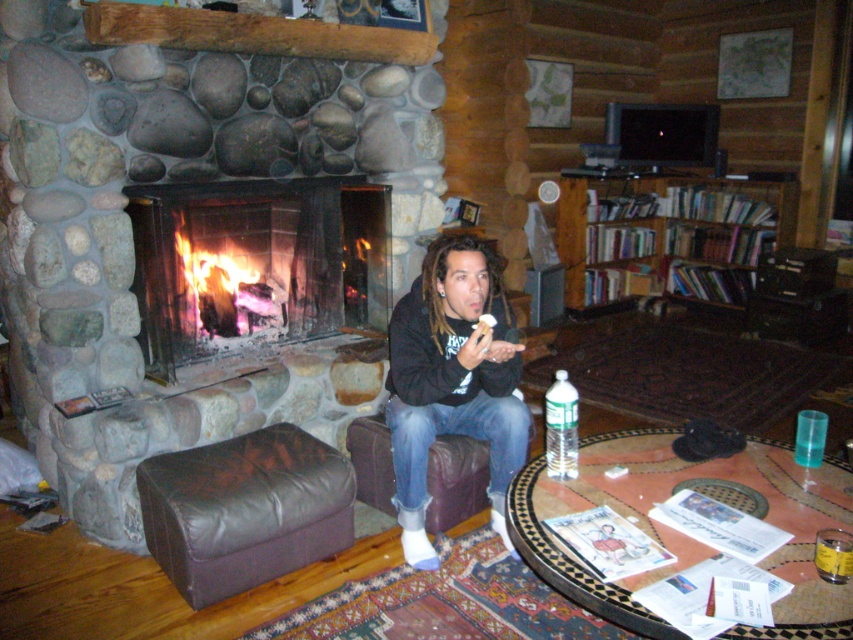
Is point (234, 472) behind point (567, 468)?

Yes, it is behind point (567, 468).

This screenshot has height=640, width=853. What do you see at coordinates (244, 509) in the screenshot?
I see `brown leather ottoman at lower center` at bounding box center [244, 509].

Where is `brown leather ottoman at lower center`? The image size is (853, 640). brown leather ottoman at lower center is located at coordinates (244, 509).

Between point (193, 241) and point (740, 256), which one is positioned in front?

Point (193, 241) is in front.

Looking at this image, does wooden fireplace at center have a greater height compared to wooden bookshelf at upper right?

No, wooden fireplace at center is not taller than wooden bookshelf at upper right.

Find the location of a particular element. This screenshot has height=640, width=853. wooden fireplace at center is located at coordinates (256, 264).

Is brown leather ottoman at lower center below wooden bookshelf at upper right?

Correct, brown leather ottoman at lower center is located below wooden bookshelf at upper right.

In order to click on brown leather ottoman at lower center in this screenshot , I will do `click(244, 509)`.

Which is behind, point (276, 573) or point (786, 225)?

Positioned behind is point (786, 225).

Where is `brown leather ottoman at lower center`? brown leather ottoman at lower center is located at coordinates (244, 509).